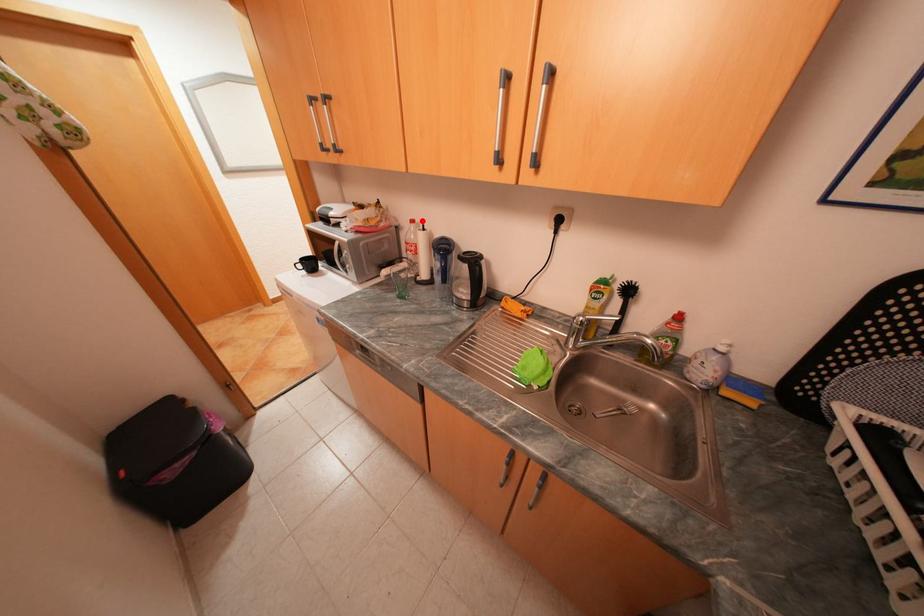
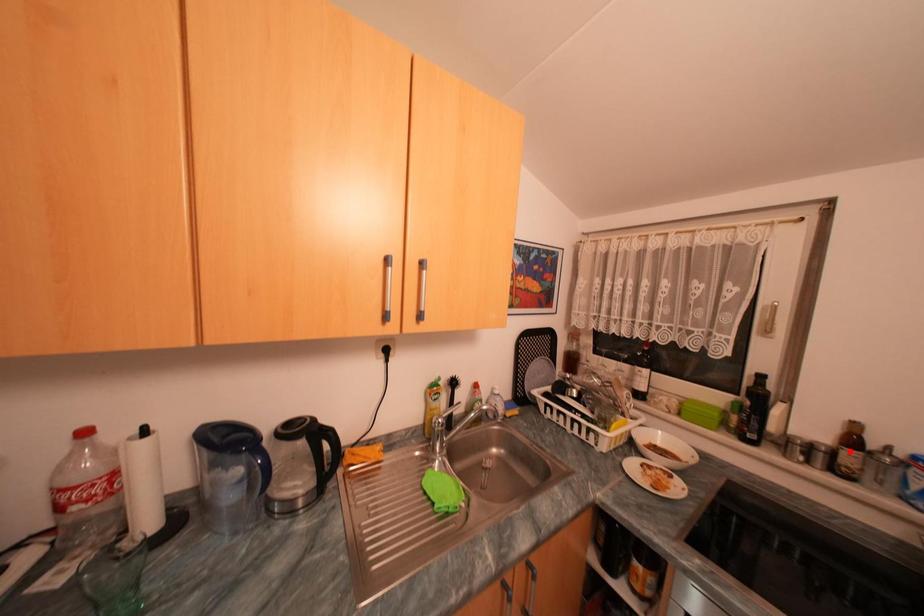
I am providing you with two images of the same scene from different viewpoints. A red point is marked on the first image and another point is marked on the second image. Is the marked point in image1 the same physical position as the marked point in image2?

No